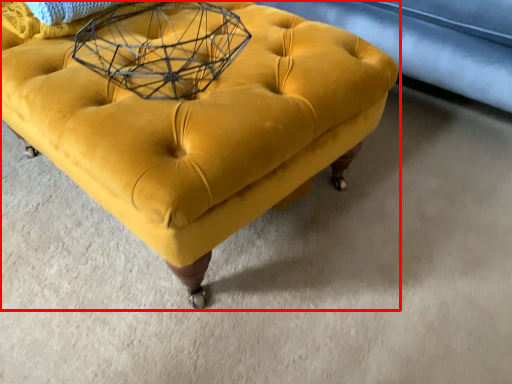
Question: From the image's perspective, where is furniture (annotated by the red box) located relative to round table?

Choices:
 (A) below
 (B) above

Answer: (A)